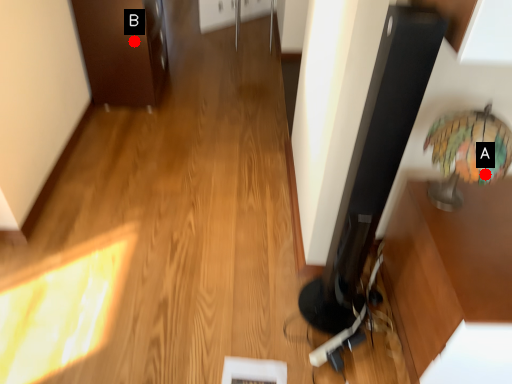
Question: Two points are circled on the image, labeled by A and B beside each circle. Which point is farther to the camera?

Choices:
 (A) A is further
 (B) B is further

Answer: (B)